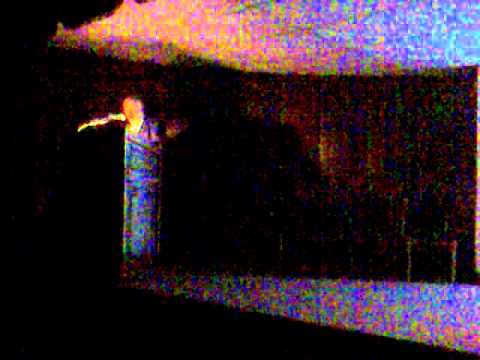
Image resolution: width=480 pixels, height=360 pixels. In order to click on light in this screenshot , I will do `click(99, 127)`, `click(112, 113)`, `click(79, 133)`.